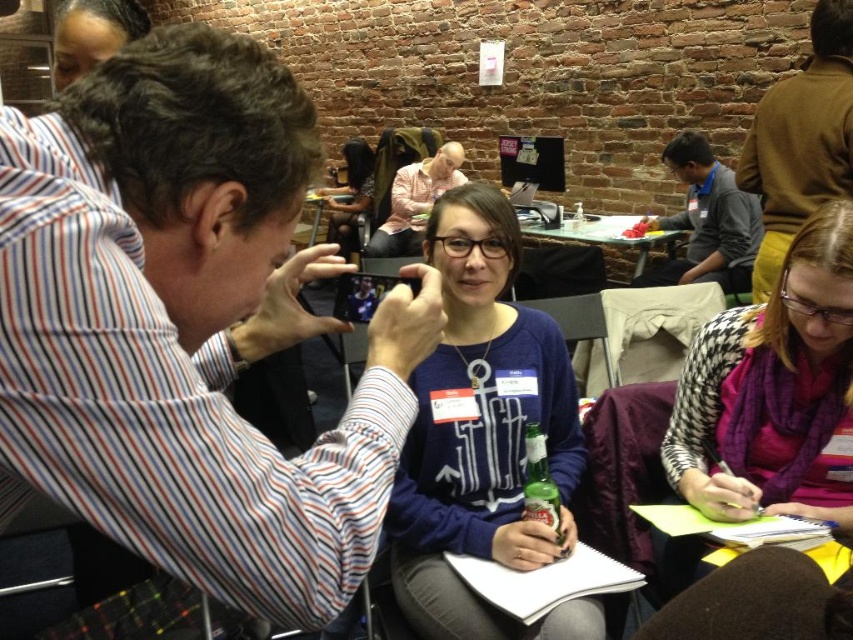
Measure the distance between gray sweater at center and dark brown hair at upper left.

gray sweater at center is 9.74 feet away from dark brown hair at upper left.

Is point (726, 234) positioned before point (61, 42)?

No, (726, 234) is behind (61, 42).

Which is behind, point (732, 289) or point (85, 17)?

The point (732, 289) is more distant.

Where is `gray sweater at center`? Image resolution: width=853 pixels, height=640 pixels. gray sweater at center is located at coordinates (706, 220).

Between purple scarf at lower right and brown leather jacket at upper right, which one has more height?

Standing taller between the two is brown leather jacket at upper right.

Based on the photo, can you confirm if purple scarf at lower right is smaller than brown leather jacket at upper right?

No.

Is point (833, 278) more distant than point (776, 132)?

No, (833, 278) is closer to viewer.

Locate an element on the screen. purple scarf at lower right is located at coordinates (773, 392).

Between point (820, 397) and point (381, 237), which one is positioned behind?

The point (381, 237) is behind.

Does purple scarf at lower right have a lesser width compared to light pink shirt at center?

Yes.

Where is `purple scarf at lower right`? This screenshot has width=853, height=640. purple scarf at lower right is located at coordinates (773, 392).